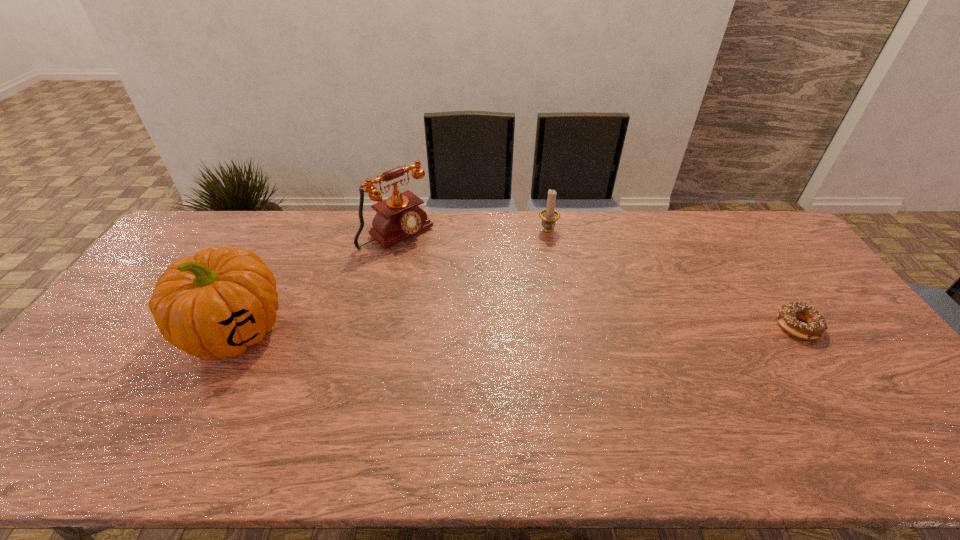
Find the location of a particular element. The image size is (960, 540). vacant space on the desktop that is between the pumpkin and the rightmost object and is positioned on the dial of the third object from right to left is located at coordinates (509, 328).

Identify the location of vacant space on the desktop that is between the leftmost object and the rightmost object and is positioned on the handle side of the second object from right to left. The height and width of the screenshot is (540, 960). (591, 328).